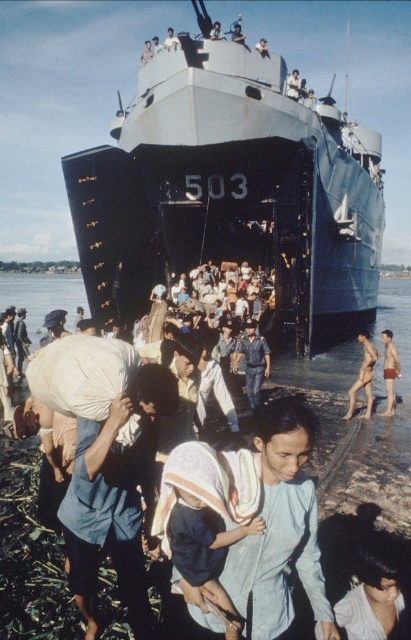
You are a photographer trying to capture the entire blue matte ship at center and the dark blue fabric at center in one frame. Given that your camera can only fit objects up to the width of the ship, will you be able to include both objects in the photo?

The blue matte ship at center is wider than the dark blue fabric at center. Since the camera can only fit objects up to the ship width, you can include both objects as the fabric is narrower than the ship.

In the historical photograph of the naval ship, you observe the dark blue fabric at center and the blue uniformed man at center. Based on their positions, which object is located to the left side of the other?

The dark blue fabric at center is to the left of blue uniformed man at center.

You are a photographer standing on the riverbank observing the dark blue fabric at center and the blue uniformed man at center. Which object is nearer to you?

The dark blue fabric at center is closer to the viewer than the blue uniformed man at center.